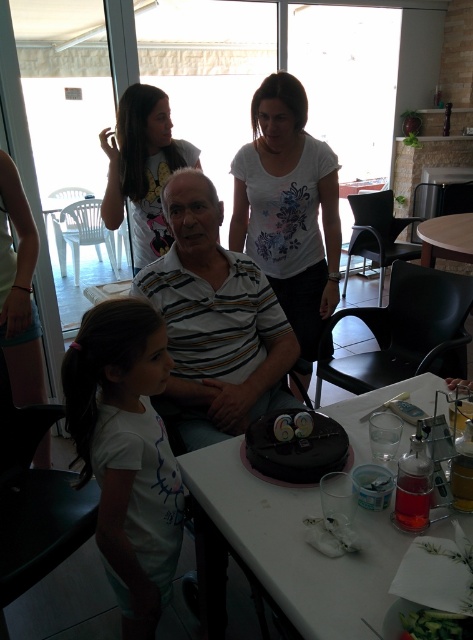
Does striped cotton shirt at center have a greater height compared to chocolate matte cake at center?

Correct, striped cotton shirt at center is much taller as chocolate matte cake at center.

Who is lower down, striped cotton shirt at center or chocolate matte cake at center?

chocolate matte cake at center is lower down.

Who is more distant from viewer, (182, 196) or (303, 419)?

Positioned behind is point (182, 196).

The width and height of the screenshot is (473, 640). Find the location of `striped cotton shirt at center`. striped cotton shirt at center is located at coordinates (215, 321).

Who is lower down, white cotton shirt at lower left or wooden table at center?

white cotton shirt at lower left is below.

Who is more forward, (112, 556) or (466, 218)?

Point (112, 556)

Does point (122, 627) lie in front of point (430, 228)?

Yes, point (122, 627) is in front of point (430, 228).

The width and height of the screenshot is (473, 640). I want to click on white cotton shirt at lower left, so click(x=126, y=452).

Consider the image. Does white floral shirt at center have a larger size compared to white cotton shirt at upper center?

Yes, white floral shirt at center is bigger than white cotton shirt at upper center.

Can you confirm if white floral shirt at center is positioned to the left of white cotton shirt at upper center?

No, white floral shirt at center is not to the left of white cotton shirt at upper center.

Which is in front, point (308, 241) or point (147, 97)?

Point (147, 97)

The height and width of the screenshot is (640, 473). Find the location of `white floral shirt at center`. white floral shirt at center is located at coordinates (289, 208).